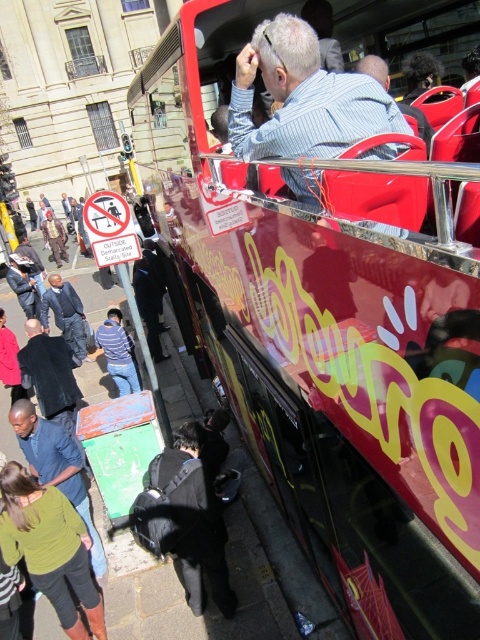
You are standing in the middle of the street looking at the red double decker bus. There are two points marked on the bus. One is at coordinate point (437, 541) and the other is at point (72, 470). Which point is closer to you?

Point (437, 541) is closer to the viewer than point (72, 470).

You are standing at the point marked as point (327, 317) in the image. What object is located at this point?

The shiny red bus at upper right is located at point (327, 317).

You are a tour guide standing at the bus stop. You need to board the shiny red bus at upper right and the blue denim shirt at lower left. Which object is wider?

The shiny red bus at upper right is narrower than the blue denim shirt at lower left, so the blue denim shirt at lower left is wider.